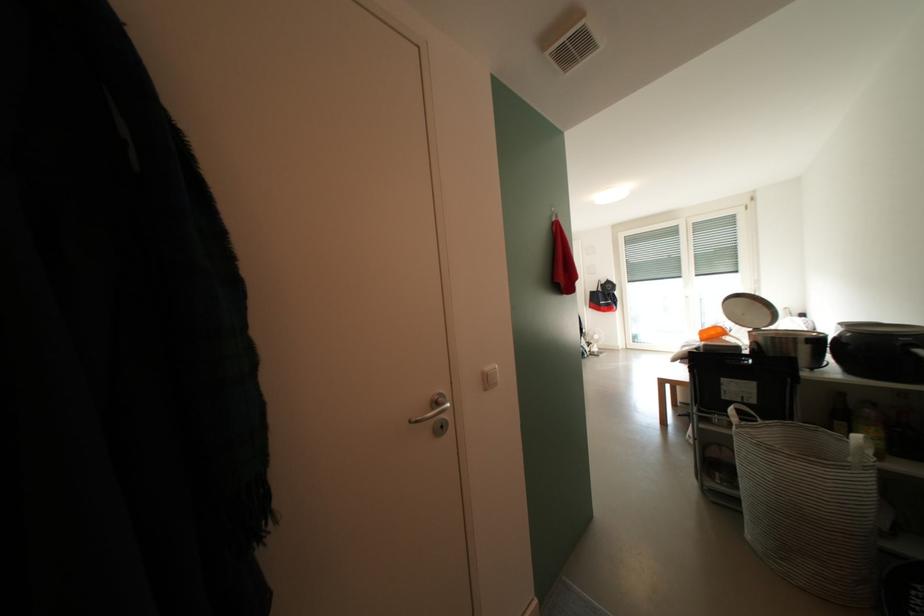
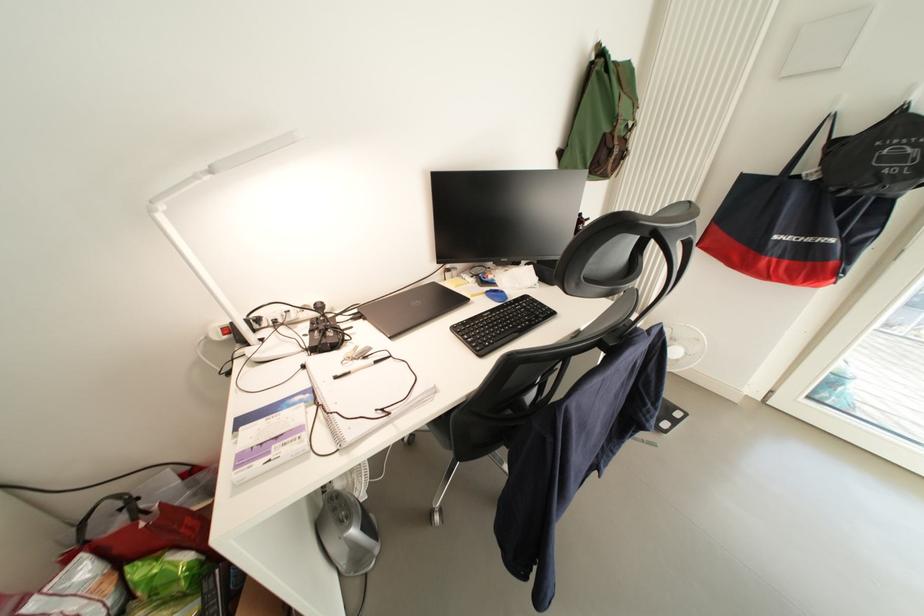
Find the pixel in the second image that matches pixel 608 299 in the first image.

(801, 203)